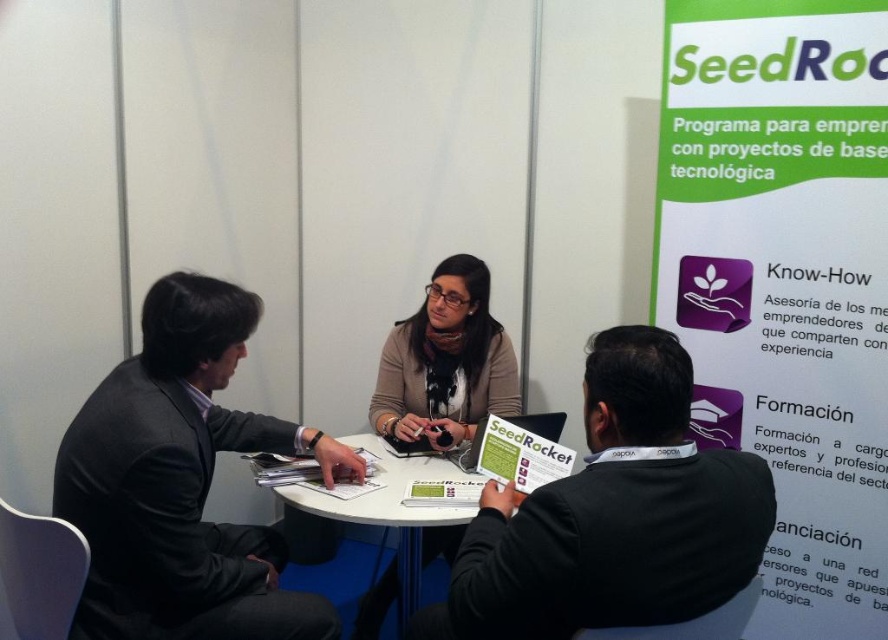
Question: Is dark gray suit at left wider than black sweater at center?

Choices:
 (A) no
 (B) yes

Answer: (B)

Question: Which object is positioned farthest from the matte beige sweater at center?

Choices:
 (A) white plastic table at center
 (B) black sweater at center
 (C) dark gray suit at left

Answer: (B)

Question: Which point is closer to the camera?

Choices:
 (A) white plastic table at center
 (B) dark gray suit at left
 (C) matte beige sweater at center

Answer: (B)

Question: Can you confirm if dark gray suit at left is bigger than white plastic table at center?

Choices:
 (A) yes
 (B) no

Answer: (A)

Question: Is black sweater at center positioned in front of matte beige sweater at center?

Choices:
 (A) yes
 (B) no

Answer: (A)

Question: Which object appears farthest from the camera in this image?

Choices:
 (A) matte beige sweater at center
 (B) white plastic table at center
 (C) dark gray suit at left
 (D) black sweater at center

Answer: (A)